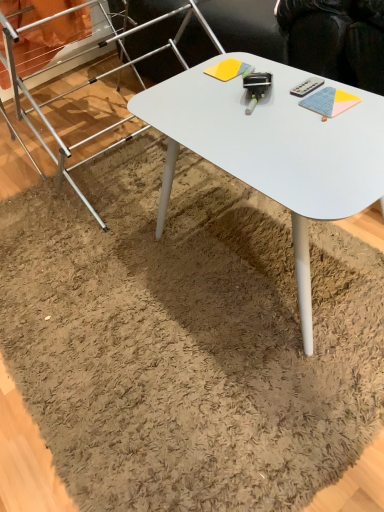
The width and height of the screenshot is (384, 512). I want to click on free area behind black plastic remote control at upper right, so click(x=266, y=71).